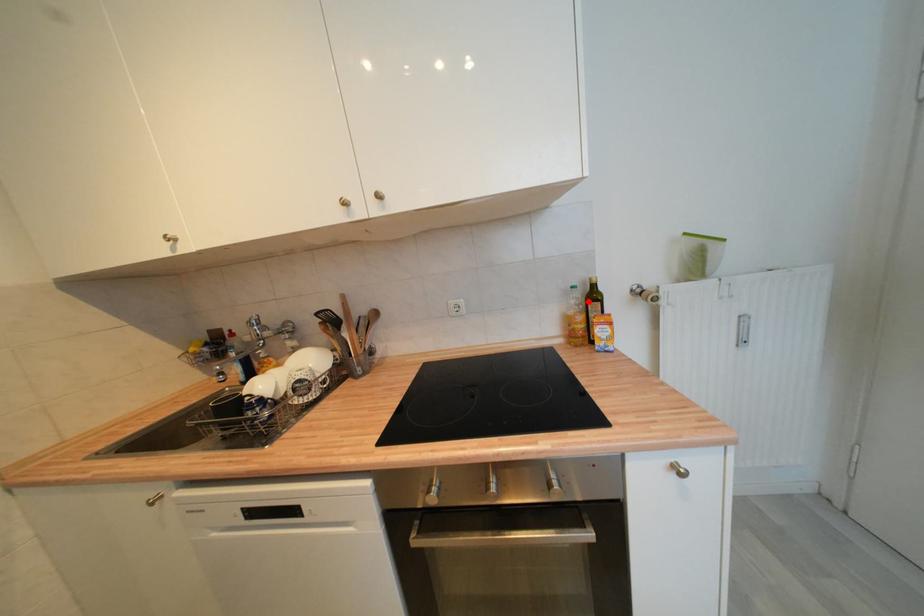
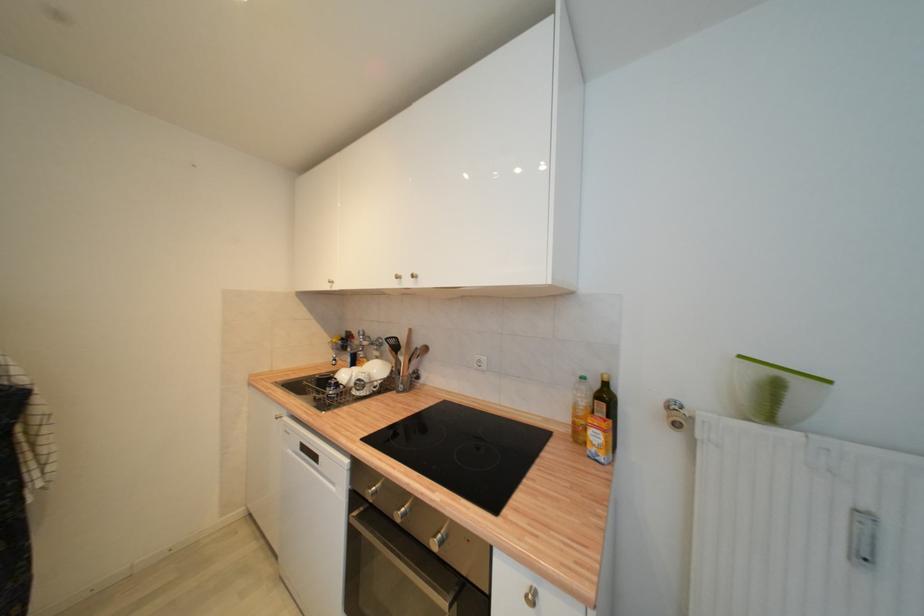
Question: I am providing you with two images of the same scene from different viewpoints. A red point is marked on the first image. Is the red point's position out of view in image 2?

Choices:
 (A) Yes
 (B) No

Answer: (B)